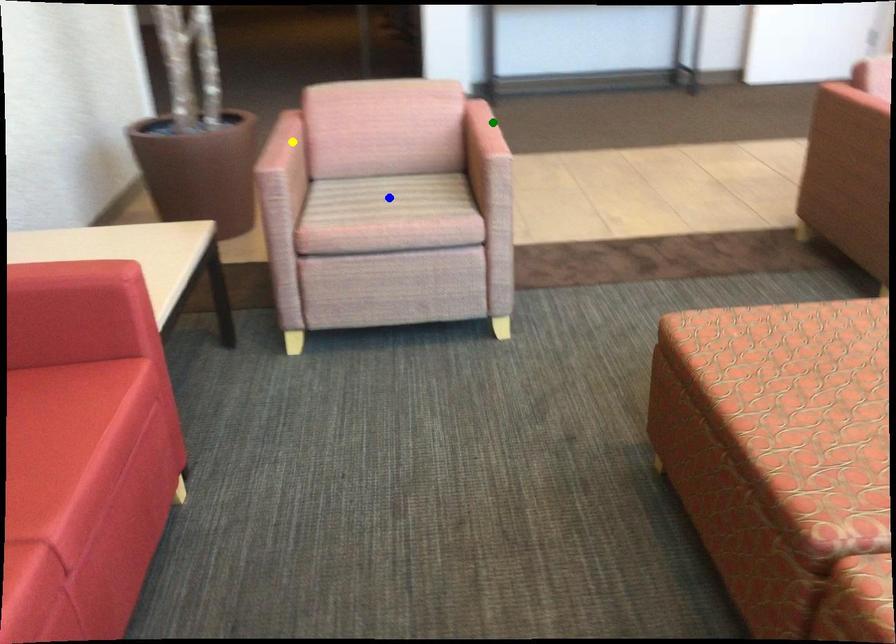
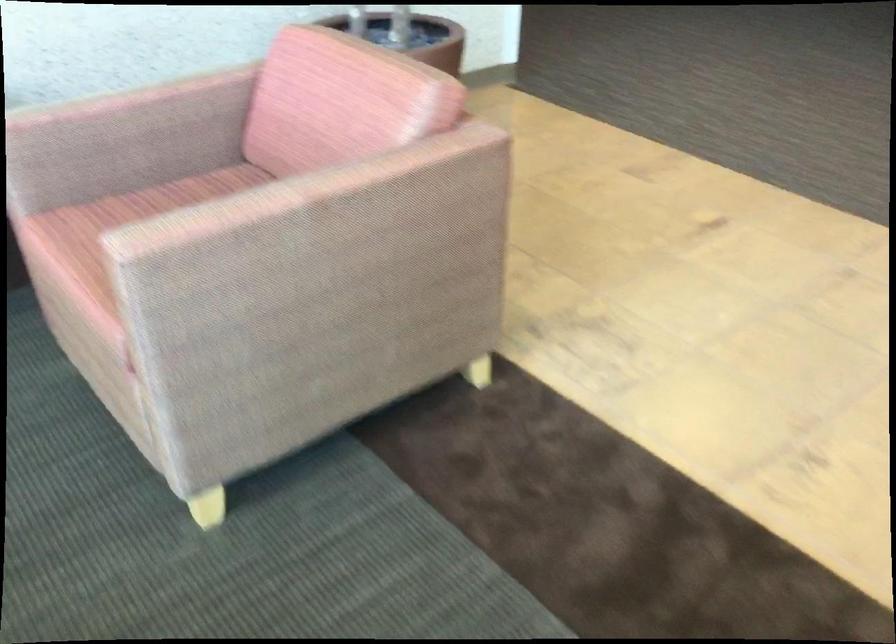
I am providing you with two images of the same scene from different viewpoints. Three points are marked in image1. Which point corresponds to a part or object that is occluded in image2?In image1, three points are marked. Which of them correspond to a part or object that is occluded in image2?Among the three points shown in image1, which one corresponds to a part or object that is no longer visible due to occlusion in image2?

Invisible in image2: blue point.